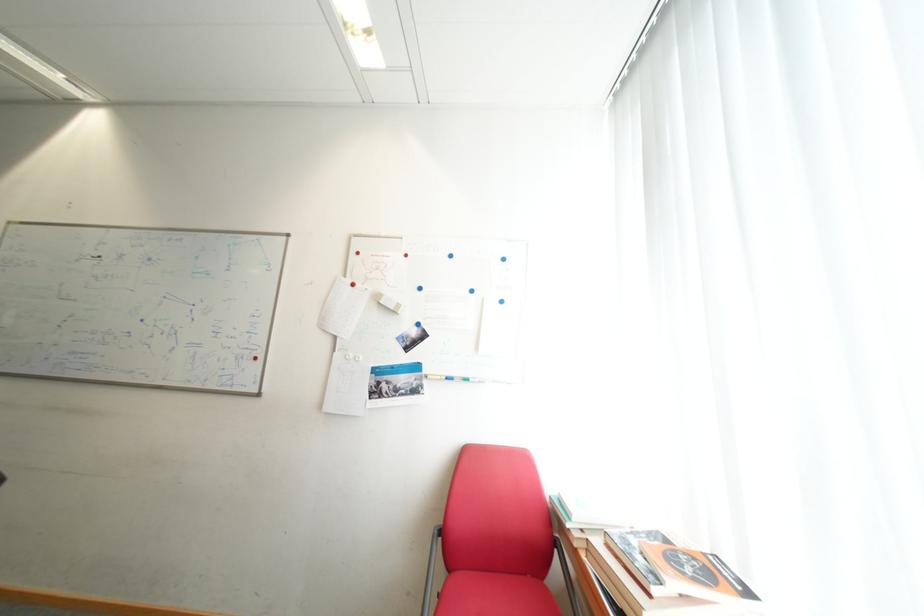
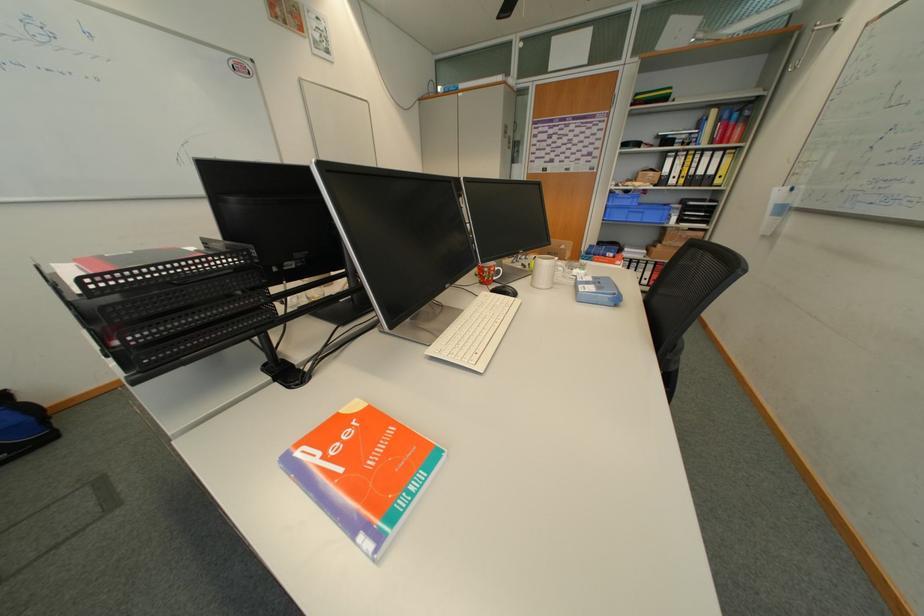
The first image is from the beginning of the video and the second image is from the end. How did the camera likely rotate when shooting the video?

The rotation direction of the camera is left-down.